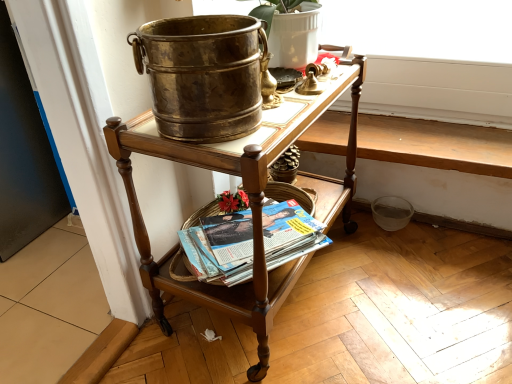
Question: Looking at their shapes, would you say matte paperbacks at lower center is wider or thinner than matte white flowerpot at upper center?

Choices:
 (A) thin
 (B) wide

Answer: (B)

Question: Considering their positions, is matte paperbacks at lower center located in front of or behind matte white flowerpot at upper center?

Choices:
 (A) behind
 (B) front

Answer: (A)

Question: Which object is the farthest from the matte white flowerpot at upper center?

Choices:
 (A) matte paperbacks at lower center
 (B) polished wood desk at center

Answer: (A)

Question: Which object is the farthest from the matte white flowerpot at upper center?

Choices:
 (A) matte paperbacks at lower center
 (B) polished wood desk at center

Answer: (A)